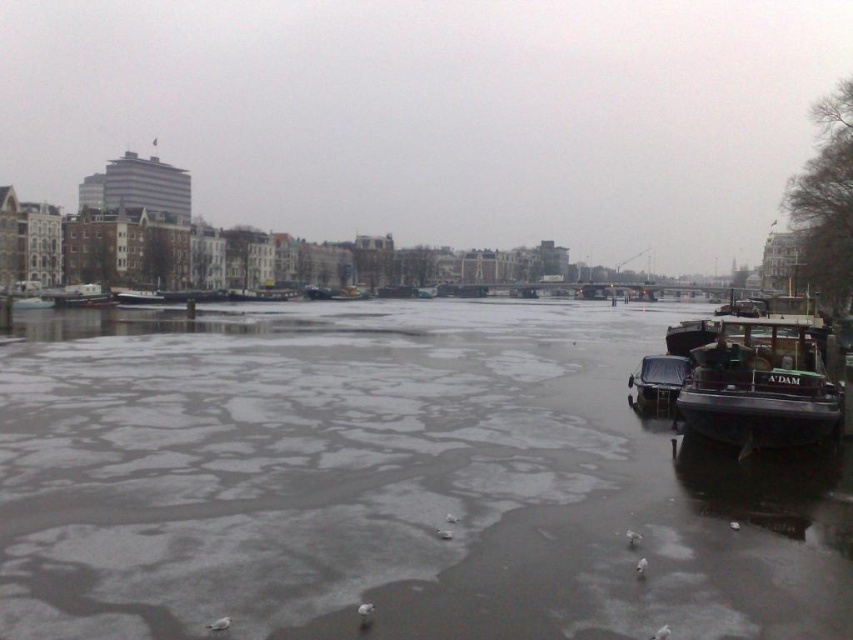
Between dark gray wooden boat at right and dark blue matte boat at right, which one appears on the left side from the viewer's perspective?

From the viewer's perspective, dark blue matte boat at right appears more on the left side.

Does point (805, 401) come behind point (640, 401)?

That is False.

The image size is (853, 640). I want to click on dark gray wooden boat at right, so click(763, 378).